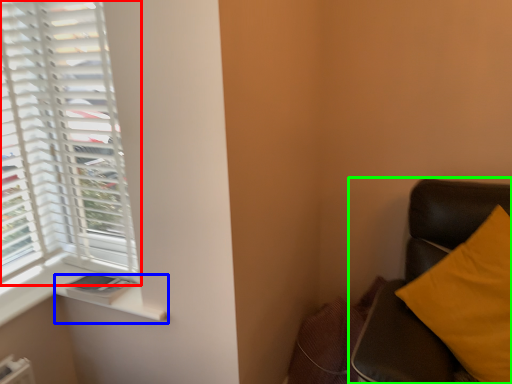
Question: Considering the real-world distances, which object is farthest from window (highlighted by a red box)? window sill (highlighted by a blue box) or furniture (highlighted by a green box)?

Choices:
 (A) window sill
 (B) furniture

Answer: (B)